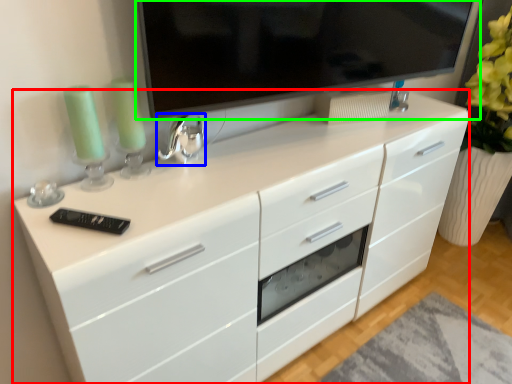
Question: Which object is the farthest from chest of drawers (highlighted by a red box)? Choose among these: appliance (highlighted by a blue box) or television (highlighted by a green box).

Choices:
 (A) appliance
 (B) television

Answer: (A)